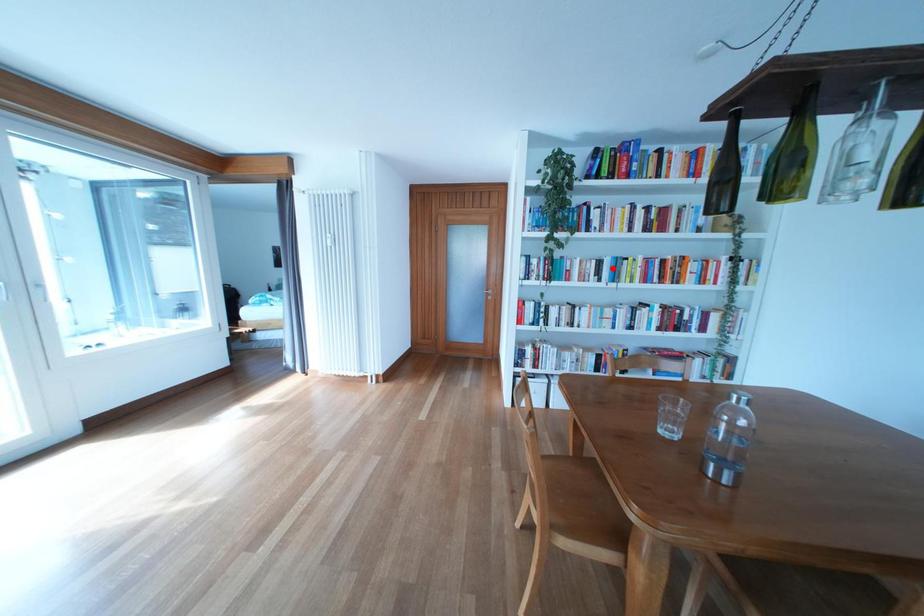
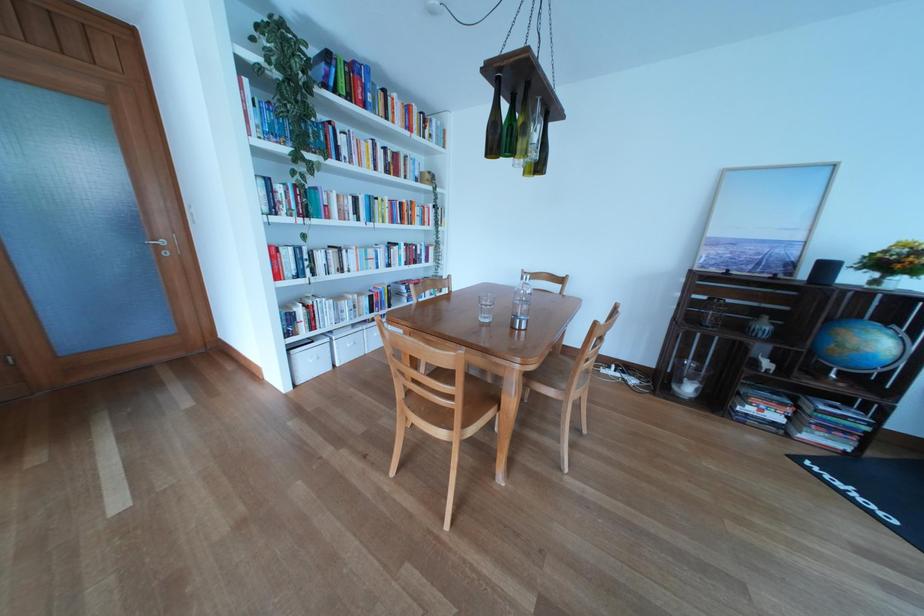
In the second image, find the point that corresponds to the highlighted location in the first image.

(369, 206)